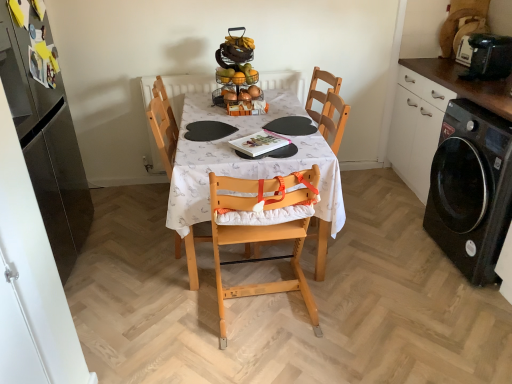
Question: Considering the relative sizes of glossy stainless steel refrigerator at left, which appears as the second cabinetry when viewed from the right, and light wood highchair at center, which is the 2th chair in left-to-right order, in the image provided, is glossy stainless steel refrigerator at left, which appears as the second cabinetry when viewed from the right, thinner than light wood highchair at center, which is the 2th chair in left-to-right order,?

Choices:
 (A) no
 (B) yes

Answer: (B)

Question: Is glossy stainless steel refrigerator at left, the 1th cabinetry viewed from the left, touching light wood highchair at center, the first chair viewed from the right?

Choices:
 (A) yes
 (B) no

Answer: (B)

Question: Is glossy stainless steel refrigerator at left, the 1th cabinetry viewed from the left, smaller than light wood highchair at center, the first chair viewed from the right?

Choices:
 (A) yes
 (B) no

Answer: (B)

Question: Could light wood highchair at center, the first chair viewed from the right, be considered to be inside glossy stainless steel refrigerator at left, which appears as the second cabinetry when viewed from the right?

Choices:
 (A) yes
 (B) no

Answer: (B)

Question: Could you tell me if glossy stainless steel refrigerator at left, the 1th cabinetry viewed from the left, is facing light wood highchair at center, the first chair viewed from the right?

Choices:
 (A) yes
 (B) no

Answer: (A)

Question: From the image's perspective, is black matte cabinet at right, which is counted as the 2th cabinetry, starting from the left, positioned above or below black plastic toaster at upper right?

Choices:
 (A) above
 (B) below

Answer: (B)

Question: From a real-world perspective, is black matte cabinet at right, the first cabinetry from the right, physically located above or below black plastic toaster at upper right?

Choices:
 (A) above
 (B) below

Answer: (B)

Question: Is black matte cabinet at right, the first cabinetry from the right, spatially inside black plastic toaster at upper right, or outside of it?

Choices:
 (A) inside
 (B) outside

Answer: (B)

Question: Is black matte cabinet at right, which is counted as the 2th cabinetry, starting from the left, bigger or smaller than black plastic toaster at upper right?

Choices:
 (A) big
 (B) small

Answer: (A)

Question: In terms of size, does light wood highchair at center, which is the 1th chair in left-to-right order, appear bigger or smaller than light wood highchair at center, the first chair viewed from the right?

Choices:
 (A) small
 (B) big

Answer: (B)

Question: Considering their positions, is light wood highchair at center, which is the 1th chair in left-to-right order, located in front of or behind light wood highchair at center, which is the 2th chair in left-to-right order?

Choices:
 (A) front
 (B) behind

Answer: (B)

Question: From their relative heights in the image, would you say light wood highchair at center, which is the 1th chair in left-to-right order, is taller or shorter than light wood highchair at center, which is the 2th chair in left-to-right order?

Choices:
 (A) tall
 (B) short

Answer: (A)

Question: Do you think light wood highchair at center, which is the 1th chair in left-to-right order, is within light wood highchair at center, the first chair viewed from the right, or outside of it?

Choices:
 (A) inside
 (B) outside

Answer: (B)

Question: From a real-world perspective, is black glossy washing machine at right physically located above or below black plastic toaster at upper right?

Choices:
 (A) below
 (B) above

Answer: (A)

Question: Considering the relative positions of black glossy washing machine at right and black plastic toaster at upper right in the image provided, is black glossy washing machine at right to the left or to the right of black plastic toaster at upper right?

Choices:
 (A) right
 (B) left

Answer: (A)